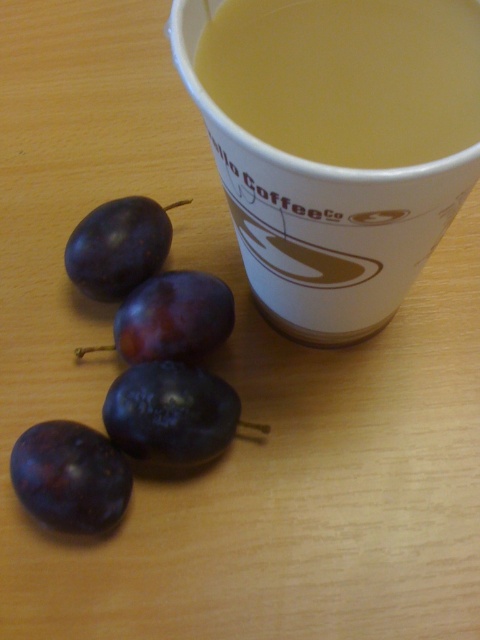
You are taking a photo of the scene and want to focus on the closest point between point (430, 113) and point (337, 240). Which point should you focus on?

Point (430, 113) is closer to the camera than point (337, 240), so you should focus on point (430, 113).

You are trying to place a small spoon on the wooden surface. The spoon is 10 cm long. The dark purple plum at lower left is located at coordinate point 0.745, 0.148. Can you place the spoon horizontally without overlapping any other objects?

The dark purple plum at lower left is located at coordinate point (71, 476). Since the spoon is 10 cm long and placed horizontally, it depends on the available space around the plum. However, the description does not provide information about the proximity of other objects or the total surface size, so we cannot confirm if there is enough space to place the spoon without overlapping.

You are organizing items on a table and need to know if the yellow liquid at upper center will spill if you tilt the yellow paper cup at upper center. Based on their heights, can you determine if tilting the cup might cause the liquid to spill?

The yellow liquid at upper center has a lesser height compared to the yellow paper cup at upper center, meaning there is space between the liquid level and the cup rim. Tilting the cup could cause the liquid to spill if the liquid level reaches the rim when tilted, but since the liquid is lower, there is some margin. However, without knowing the tilt angle, it is uncertain. The answer should strictly use the given info. Since the liquid is shorter than the cup, tilting might not spill unless the tilt angle